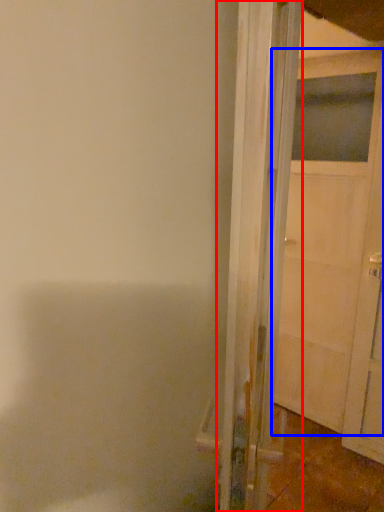
Question: Which object appears closest to the camera in this image, door (highlighted by a red box) or door (highlighted by a blue box)?

Choices:
 (A) door
 (B) door

Answer: (A)